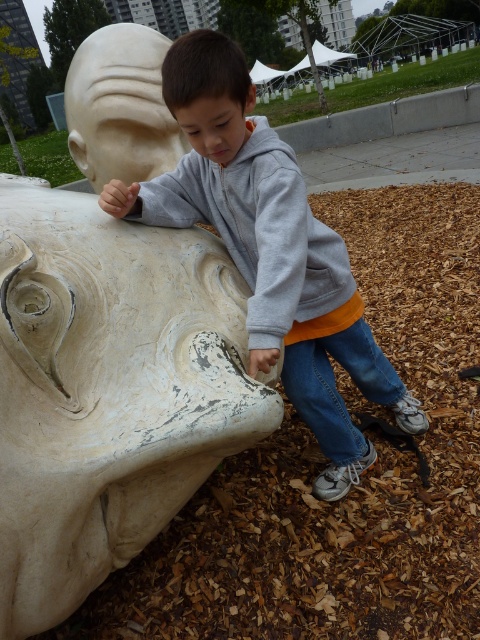
Question: Estimate the real-world distances between objects in this image. Which object is closer to the gray fleece sweatshirt at upper center?

Choices:
 (A) white weathered stone bust at lower left
 (B) gray matte hoodie at center
 (C) white matte sculpture at center

Answer: (B)

Question: Which of these objects is positioned farthest from the gray fleece sweatshirt at upper center?

Choices:
 (A) white weathered stone bust at lower left
 (B) white matte sculpture at center
 (C) gray matte hoodie at center

Answer: (A)

Question: Can you confirm if white weathered stone bust at lower left is bigger than gray matte hoodie at center?

Choices:
 (A) yes
 (B) no

Answer: (B)

Question: Which point is farther to the camera?

Choices:
 (A) (226, 209)
 (B) (113, 195)
 (C) (201, 419)

Answer: (A)

Question: From the image, what is the correct spatial relationship of gray matte hoodie at center in relation to white matte sculpture at center?

Choices:
 (A) left
 (B) right

Answer: (B)

Question: Can you confirm if white weathered stone bust at lower left is smaller than gray matte hoodie at center?

Choices:
 (A) yes
 (B) no

Answer: (A)